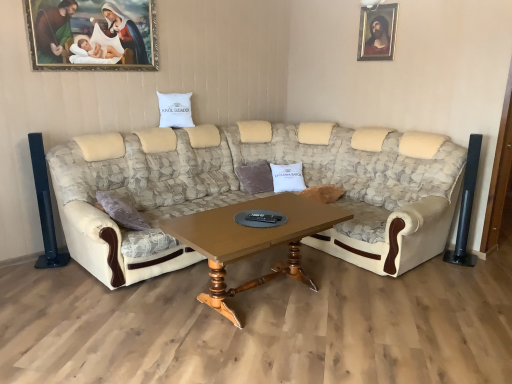
This screenshot has width=512, height=384. Describe the element at coordinates (377, 32) in the screenshot. I see `wooden framed portrait at upper right, which appears as the first picture frame when viewed from the right` at that location.

The width and height of the screenshot is (512, 384). Find the location of `wooden polished table at center`. wooden polished table at center is located at coordinates (251, 240).

Locate an element on the screen. This screenshot has width=512, height=384. studio couch on the right of wooden polished table at center is located at coordinates (253, 197).

Which is in front, point (280, 207) or point (140, 174)?

Point (280, 207)

Is wooden polished table at center shorter than beige fabric couch at center?

Correct, wooden polished table at center is not as tall as beige fabric couch at center.

How different are the orientations of wooden polished table at center and beige fabric couch at center in degrees?

The facing directions of wooden polished table at center and beige fabric couch at center are 1.57 degrees apart.

Considering the sizes of objects wooden framed painting at upper left, which is the 2th picture frame in back-to-front order, and wooden polished table at center in the image provided, who is taller, wooden framed painting at upper left, which is the 2th picture frame in back-to-front order, or wooden polished table at center?

wooden framed painting at upper left, which is the 2th picture frame in back-to-front order, is taller.

Is the position of wooden framed painting at upper left, which is the 2th picture frame in back-to-front order, less distant than that of wooden polished table at center?

No, it is behind wooden polished table at center.

Is wooden framed painting at upper left, the 1th picture frame when ordered from left to right, oriented towards wooden polished table at center?

No, wooden framed painting at upper left, the 1th picture frame when ordered from left to right, is not facing towards wooden polished table at center.

Which is farther from the camera, (48, 56) or (197, 250)?

Positioned behind is point (48, 56).

Is wooden framed portrait at upper right, which appears as the first picture frame when viewed from the right, oriented away from white soft pillow at center?

wooden framed portrait at upper right, which appears as the first picture frame when viewed from the right, does not have its back to white soft pillow at center.

Does point (374, 26) lie in front of point (296, 168)?

Yes, it is.

Between wooden framed portrait at upper right, arranged as the 1th picture frame when viewed from the back, and white soft pillow at center, which one is positioned behind?

white soft pillow at center.

How different are the orientations of beige fabric couch at center and wooden framed portrait at upper right, the 2th picture frame viewed from the front, in degrees?

There is a 89.8-degree angle between the facing directions of beige fabric couch at center and wooden framed portrait at upper right, the 2th picture frame viewed from the front.

From the picture: From the image's perspective, which one is positioned lower, beige fabric couch at center or wooden framed portrait at upper right, arranged as the 1th picture frame when viewed from the back?

beige fabric couch at center appears lower in the image.

From the picture: Measure the distance between beige fabric couch at center and wooden framed portrait at upper right, which appears as the first picture frame when viewed from the right.

beige fabric couch at center and wooden framed portrait at upper right, which appears as the first picture frame when viewed from the right, are 5.20 feet apart.

Looking at the image, does beige fabric couch at center seem bigger or smaller compared to wooden framed portrait at upper right, the 2th picture frame viewed from the front?

Considering their sizes, beige fabric couch at center takes up more space than wooden framed portrait at upper right, the 2th picture frame viewed from the front.

In the scene shown: Is white soft pillow at center located within beige fabric couch at center?

Yes, white soft pillow at center can be found within beige fabric couch at center.

Can you tell me how much beige fabric couch at center and white soft pillow at center differ in facing direction?

36.4 degrees.

Can you confirm if beige fabric couch at center is taller than white soft pillow at center?

Indeed, beige fabric couch at center has a greater height compared to white soft pillow at center.

This screenshot has width=512, height=384. Find the location of `studio couch that appears above the white soft pillow at center (from a real-world perspective)`. studio couch that appears above the white soft pillow at center (from a real-world perspective) is located at coordinates (253, 197).

Is beige fabric couch at center facing away from wooden framed painting at upper left, the second picture frame when ordered from right to left?

No, wooden framed painting at upper left, the second picture frame when ordered from right to left, is not at the back of beige fabric couch at center.

Is beige fabric couch at center closer to camera compared to wooden framed painting at upper left, which is the 1th picture frame in front-to-back order?

Yes, it is.

Could wooden framed painting at upper left, which is the 1th picture frame in front-to-back order, be considered to be inside beige fabric couch at center?

No, wooden framed painting at upper left, which is the 1th picture frame in front-to-back order, is located outside of beige fabric couch at center.

From a real-world perspective, which object stands above the other?

wooden framed painting at upper left, the 1th picture frame when ordered from left to right, from a real-world perspective.

Where is `coffee table lying below the wooden framed painting at upper left, the 1th picture frame when ordered from left to right (from the image's perspective)`? coffee table lying below the wooden framed painting at upper left, the 1th picture frame when ordered from left to right (from the image's perspective) is located at coordinates (251, 240).

Considering the positions of objects wooden polished table at center and wooden framed painting at upper left, which is the 2th picture frame in back-to-front order, in the image provided, who is behind, wooden polished table at center or wooden framed painting at upper left, which is the 2th picture frame in back-to-front order,?

wooden framed painting at upper left, which is the 2th picture frame in back-to-front order, is behind.

Can you confirm if wooden polished table at center is positioned to the left of wooden framed painting at upper left, the second picture frame when ordered from right to left?

No.

Consider the image. Considering the sizes of wooden polished table at center and wooden framed painting at upper left, the second picture frame when ordered from right to left, in the image, is wooden polished table at center wider or thinner than wooden framed painting at upper left, the second picture frame when ordered from right to left,?

Considering their sizes, wooden polished table at center looks broader than wooden framed painting at upper left, the second picture frame when ordered from right to left.

Find the location of a particular element. The image size is (512, 384). studio couch located above the wooden polished table at center (from a real-world perspective) is located at coordinates point(253,197).

Find the location of a particular element. This screenshot has height=384, width=512. coffee table on the right of wooden framed painting at upper left, which is the 1th picture frame in front-to-back order is located at coordinates [x=251, y=240].

From the picture: Considering their positions, is beige fabric couch at center positioned further to white soft pillow at center than wooden polished table at center?

wooden polished table at center lies further to white soft pillow at center than the other object.

Based on their spatial positions, is wooden framed portrait at upper right, arranged as the 1th picture frame when viewed from the back, or white soft pillow at center further from wooden framed painting at upper left, which is the 2th picture frame in back-to-front order?

wooden framed portrait at upper right, arranged as the 1th picture frame when viewed from the back, is further to wooden framed painting at upper left, which is the 2th picture frame in back-to-front order.

Based on their spatial positions, is wooden polished table at center or wooden framed portrait at upper right, which appears as the first picture frame when viewed from the right, closer to wooden framed painting at upper left, the second picture frame when ordered from right to left?

wooden polished table at center.

Which object lies nearer to the anchor point white soft pillow at center, wooden framed painting at upper left, which is the 1th picture frame in front-to-back order, or beige fabric couch at center?

Among the two, beige fabric couch at center is located nearer to white soft pillow at center.

Estimate the real-world distances between objects in this image. Which object is closer to wooden framed portrait at upper right, marked as the 2th picture frame in a left-to-right arrangement, wooden polished table at center or beige fabric couch at center?

beige fabric couch at center is positioned closer to the anchor wooden framed portrait at upper right, marked as the 2th picture frame in a left-to-right arrangement.

Based on their spatial positions, is wooden polished table at center or white soft pillow at center further from beige fabric couch at center?

Among the two, white soft pillow at center is located further to beige fabric couch at center.

When comparing their distances from wooden framed portrait at upper right, marked as the 2th picture frame in a left-to-right arrangement, does wooden framed painting at upper left, the 1th picture frame when ordered from left to right, or white soft pillow at center seem further?

Based on the image, wooden framed painting at upper left, the 1th picture frame when ordered from left to right, appears to be further to wooden framed portrait at upper right, marked as the 2th picture frame in a left-to-right arrangement.

Which object lies nearer to the anchor point wooden framed painting at upper left, the 1th picture frame when ordered from left to right, wooden framed portrait at upper right, the 2th picture frame viewed from the front, or beige fabric couch at center?

Based on the image, beige fabric couch at center appears to be nearer to wooden framed painting at upper left, the 1th picture frame when ordered from left to right.

Where is `studio couch between wooden framed painting at upper left, the 1th picture frame when ordered from left to right, and wooden framed portrait at upper right, which appears as the first picture frame when viewed from the right, in the horizontal direction`? studio couch between wooden framed painting at upper left, the 1th picture frame when ordered from left to right, and wooden framed portrait at upper right, which appears as the first picture frame when viewed from the right, in the horizontal direction is located at coordinates (253, 197).

In order to click on studio couch that lies between wooden framed painting at upper left, which is the 1th picture frame in front-to-back order, and wooden polished table at center from top to bottom in this screenshot , I will do `click(253, 197)`.

Locate an element on the screen. This screenshot has height=384, width=512. coffee table positioned between beige fabric couch at center and wooden framed portrait at upper right, marked as the 2th picture frame in a left-to-right arrangement, from near to far is located at coordinates (251, 240).

You are a GUI agent. You are given a task and a screenshot of the screen. Output one action in this format:
    pyautogui.click(x=<x>, y=<y>)
    Task: Click on the pillow between wooden framed painting at upper left, which is the 1th picture frame in front-to-back order, and wooden framed portrait at upper right, marked as the 2th picture frame in a left-to-right arrangement, in the horizontal direction
    
    Given the screenshot: What is the action you would take?
    pyautogui.click(x=287, y=177)